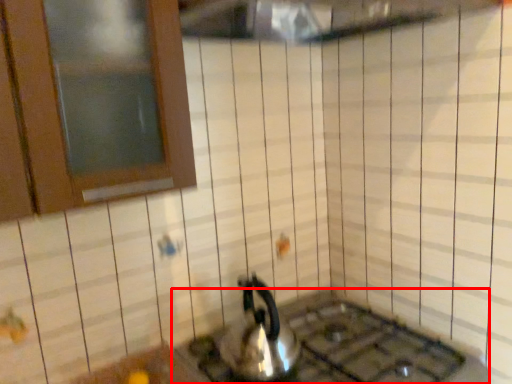
Question: Where is gas stove (annotated by the red box) located in relation to kettle in the image?

Choices:
 (A) left
 (B) right

Answer: (B)